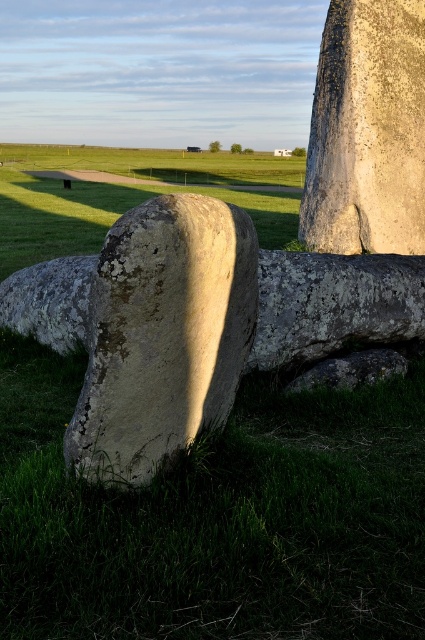
You are standing at the base of the ancient stone monument and see two points marked in the image. The first point is at coordinates point (138, 483) and the second is at point (357, 156). Which of these two points is closer to you as you stand at the base?

Point (138, 483) is in front of point (357, 156), so it is closer to you.